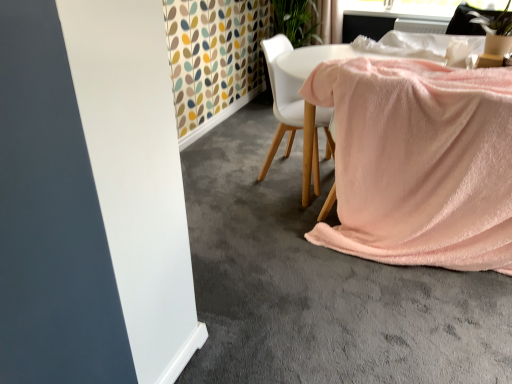
This screenshot has height=384, width=512. What are the coordinates of `free space in front of pink soft fabric at center` in the screenshot? It's located at (357, 306).